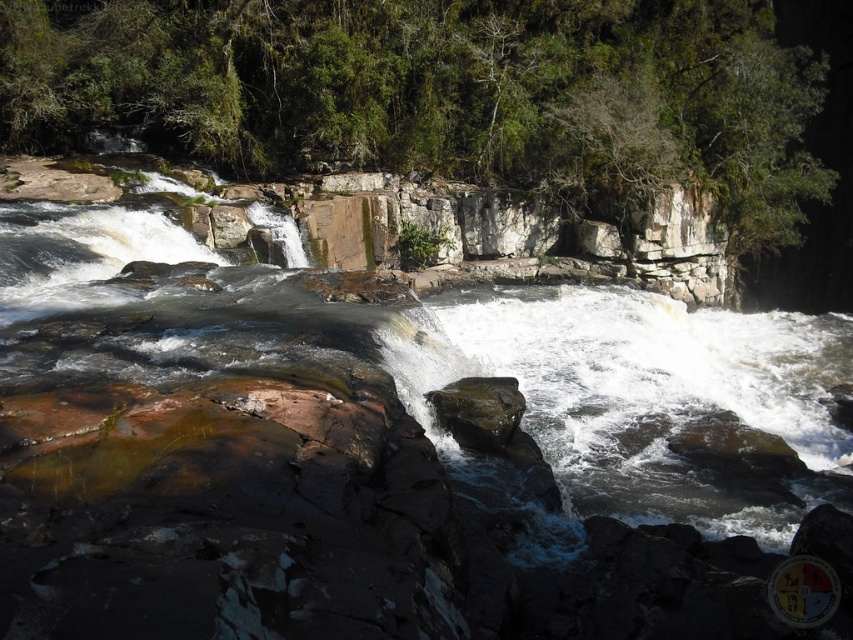
Question: Considering the relative positions of green leafy tree at upper center and rusty rock at center in the image provided, where is green leafy tree at upper center located with respect to rusty rock at center?

Choices:
 (A) left
 (B) right

Answer: (B)

Question: Does green leafy tree at upper center appear on the left side of rusty rock at center?

Choices:
 (A) no
 (B) yes

Answer: (A)

Question: Which object appears farthest from the camera in this image?

Choices:
 (A) rusty rock at center
 (B) green leafy tree at upper center

Answer: (B)

Question: Which point is farther from the camera taking this photo?

Choices:
 (A) (260, 32)
 (B) (494, 387)

Answer: (A)

Question: Does green leafy tree at upper center have a lesser width compared to rusty rock at center?

Choices:
 (A) yes
 (B) no

Answer: (B)